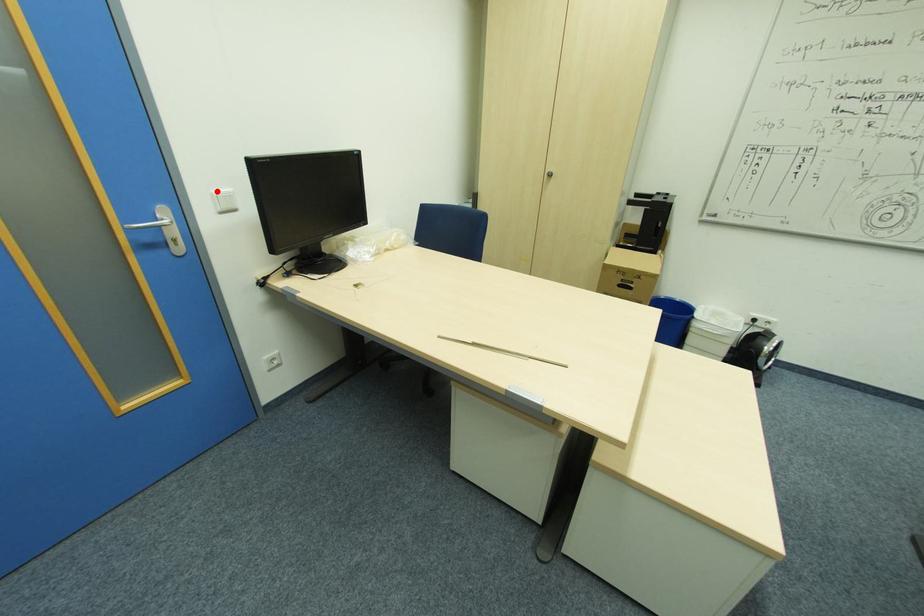
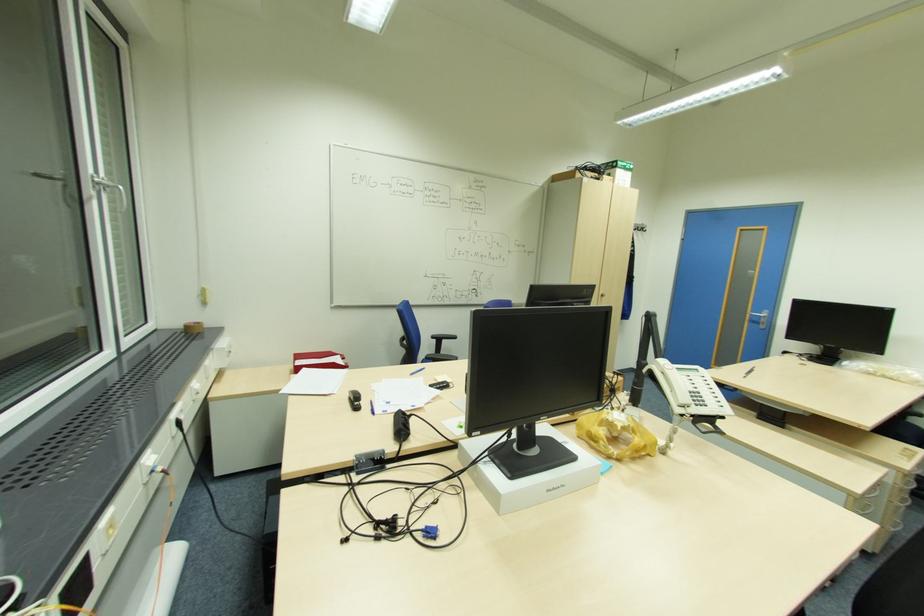
Question: I am providing you with two images of the same scene from different viewpoints. A red point is marked on the first image. Can you still see the location of the red point in image 2?

Choices:
 (A) Yes
 (B) No

Answer: (B)